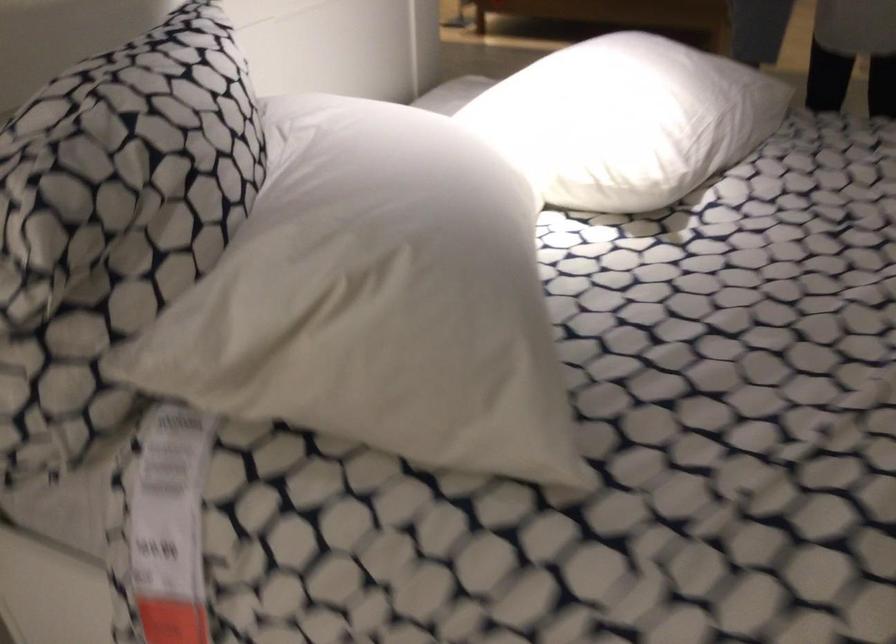
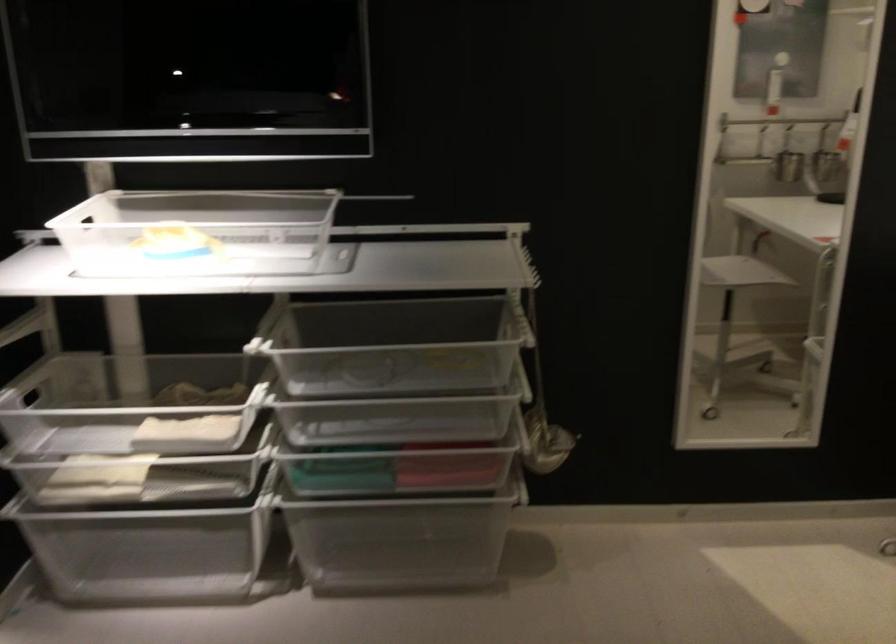
Based on the continuous images, in which direction is the camera rotating?

The camera's rotation is toward right-down.